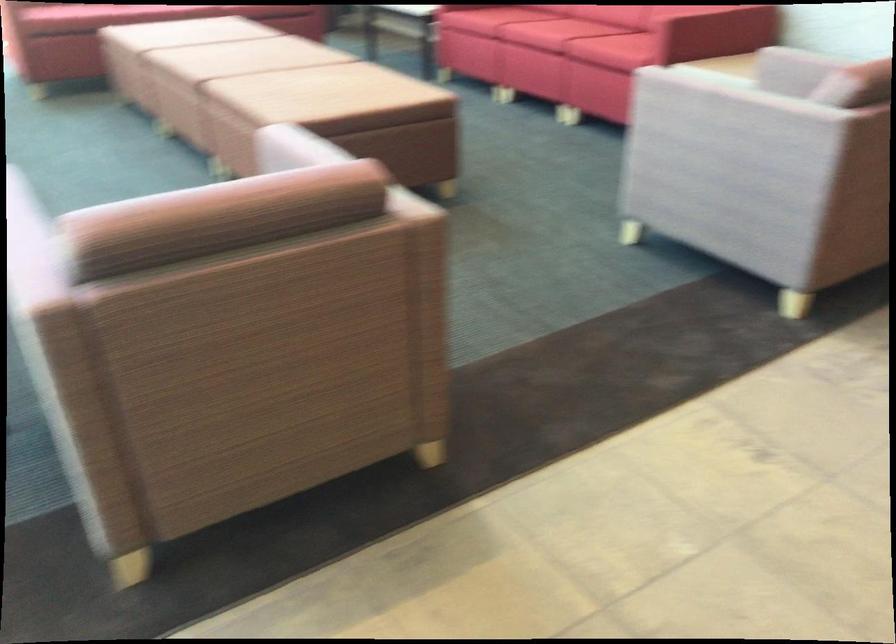
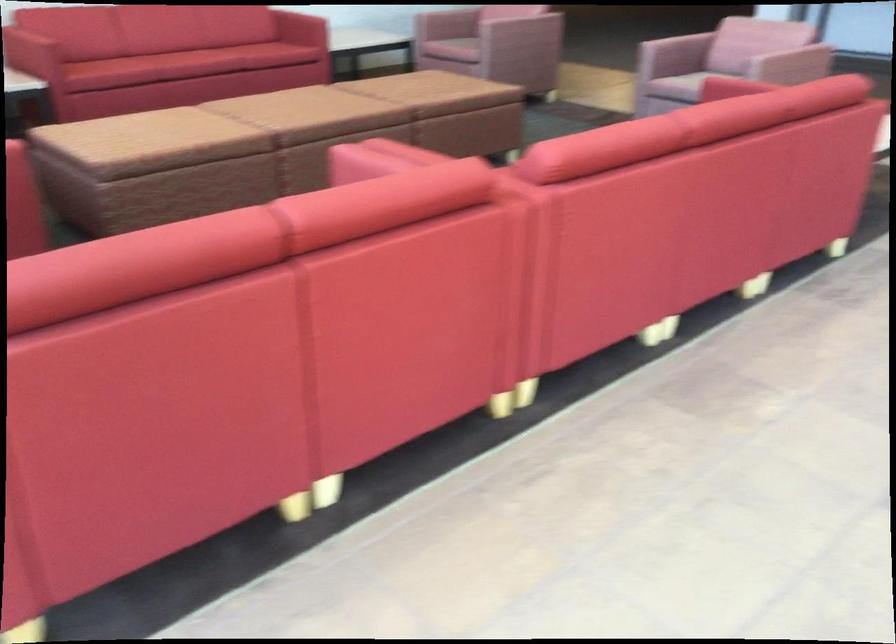
Question: What movement of the cameraman would produce the second image?

Choices:
 (A) Left
 (B) Right
 (C) Forward
 (D) Backward

Answer: (D)